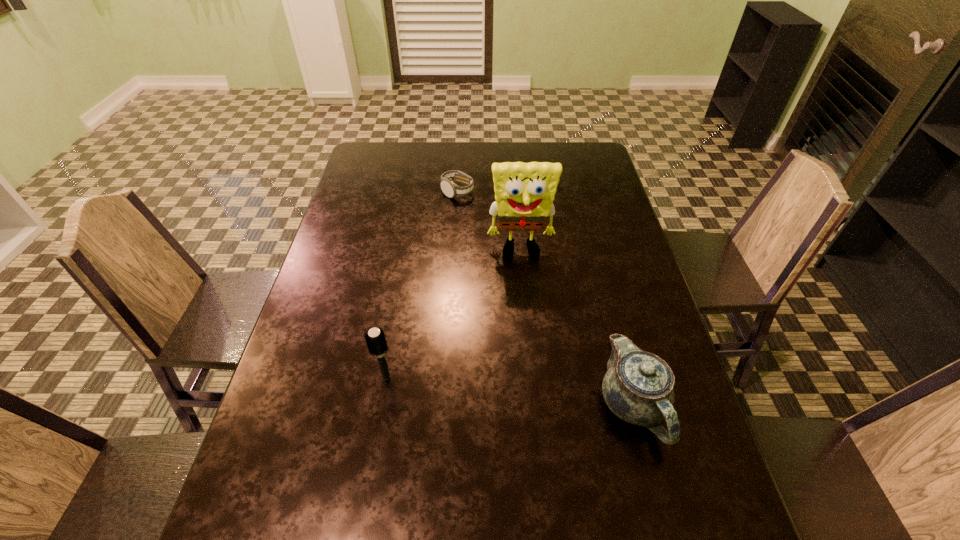
Locate an element on the screen. vacant space on the desktop that is between the hairbrush and the third tallest object and is positioned on the face of the shortest object is located at coordinates (509, 390).

Find the location of a particular element. free spot on the desktop that is between the hairbrush and the rightmost object and is positioned on the face of the tallest object is located at coordinates (534, 394).